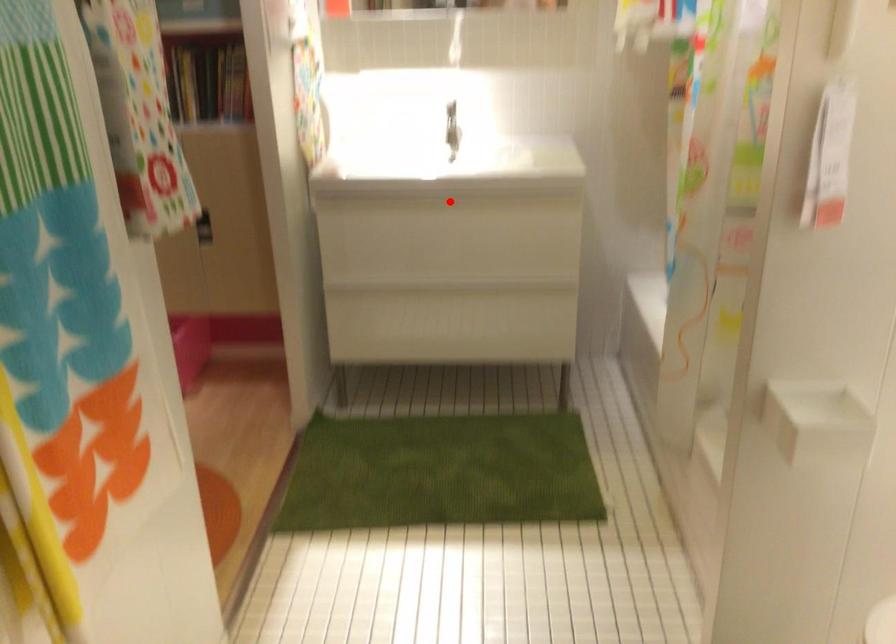
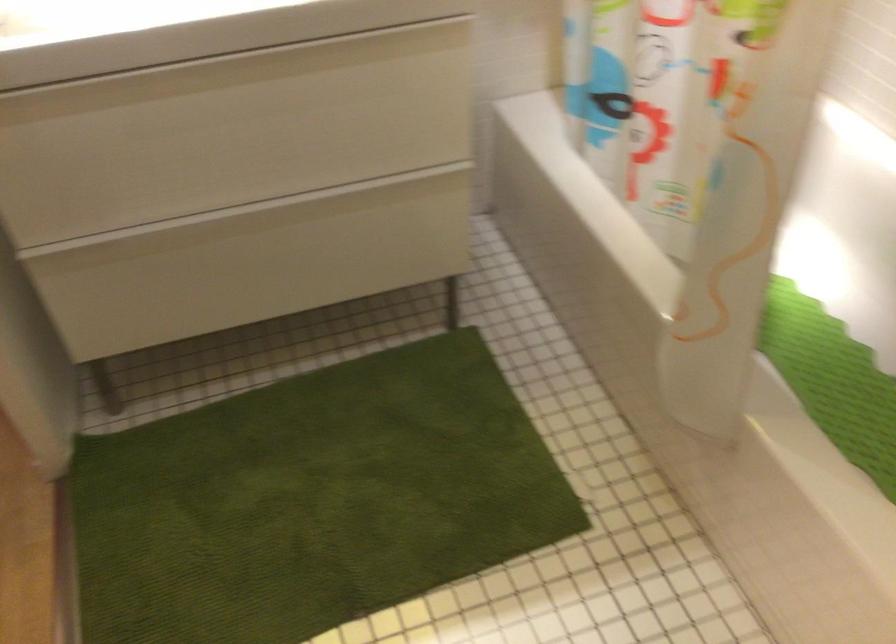
Locate, in the second image, the point that corresponds to the highlighted location in the first image.

(228, 70)